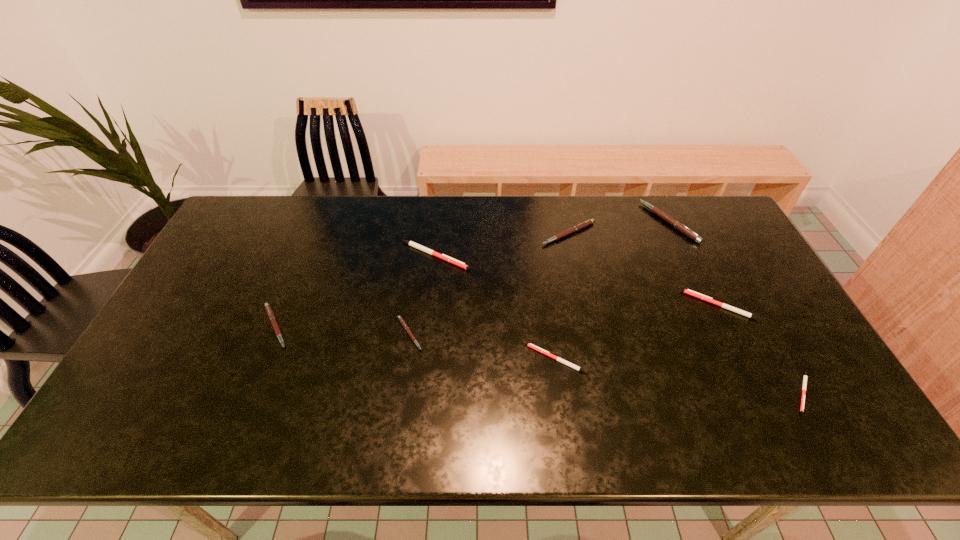
You are a GUI agent. You are given a task and a screenshot of the screen. Output one action in this format:
    pyautogui.click(x=<x>, y=<y>)
    Task: Click on the free space that is in between the second white pen from left to right and the second pink pen from left to right
    Image resolution: width=960 pixels, height=540 pixels.
    Given the screenshot: What is the action you would take?
    pyautogui.click(x=483, y=346)

Identify the location of free spot between the third white pen from right to left and the third nearest white pen. Image resolution: width=960 pixels, height=540 pixels. (637, 332).

At what (x,y) coordinates should I click in order to perform the action: click on free point between the smallest white pen and the rightmost pink pen. Please return your answer as a coordinate pair (x, y). Looking at the image, I should click on (736, 307).

The width and height of the screenshot is (960, 540). I want to click on free space between the third smallest white pen and the biggest white pen, so click(577, 281).

Locate an element on the screen. This screenshot has height=540, width=960. unoccupied position between the second pink pen from left to right and the tallest pen is located at coordinates (539, 278).

Point out which object is positioned as the fifth nearest to the farthest white pen. Please provide its 2D coordinates. Your answer should be formatted as a tuple, i.e. [(x, y)], where the tuple contains the x and y coordinates of a point satisfying the conditions above.

[(682, 228)]

Identify which object is located as the seventh nearest to the third smallest pink pen. Please provide its 2D coordinates. Your answer should be formatted as a tuple, i.e. [(x, y)], where the tuple contains the x and y coordinates of a point satisfying the conditions above.

[(269, 311)]

Locate which pen is the fifth closest to the leftmost white pen. Please provide its 2D coordinates. Your answer should be formatted as a tuple, i.e. [(x, y)], where the tuple contains the x and y coordinates of a point satisfying the conditions above.

[(682, 228)]

Point out which pen is positioned as the sixth nearest to the biggest white pen. Please provide its 2D coordinates. Your answer should be formatted as a tuple, i.e. [(x, y)], where the tuple contains the x and y coordinates of a point satisfying the conditions above.

[(688, 291)]

You are a GUI agent. You are given a task and a screenshot of the screen. Output one action in this format:
    pyautogui.click(x=<x>, y=<y>)
    Task: Click on the pink pen that is the closest one to the leftmost pink pen
    The image size is (960, 540).
    Given the screenshot: What is the action you would take?
    pyautogui.click(x=400, y=319)